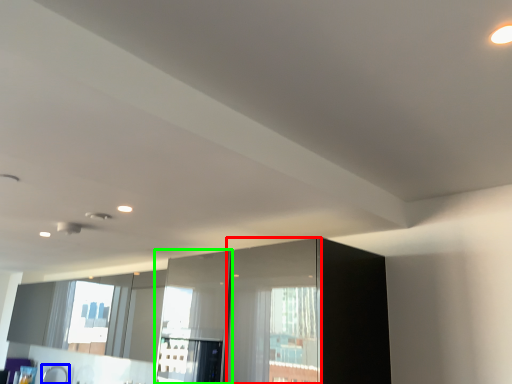
Question: Considering the real-world distances, which object is closest to screen door (highlighted by a red box)? faucet (highlighted by a blue box) or screen door (highlighted by a green box).

Choices:
 (A) faucet
 (B) screen door

Answer: (B)